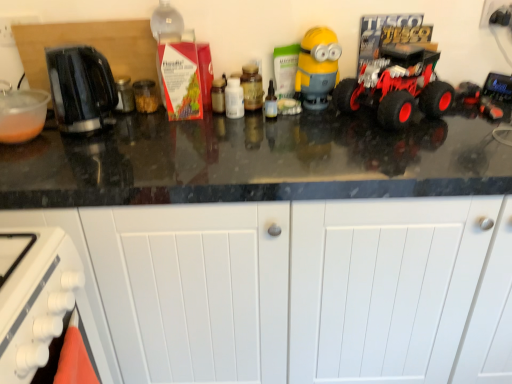
I want to click on transparent glass bottle at center, arranged as the 1th bottle when viewed from the right, so click(270, 103).

In order to face white plastic bottle at center, marked as the 1th bottle in a left-to-right arrangement, should I rotate leftwards or rightwards?

It's best to rotate left around 2.786 degrees.

Measure the distance between point (335, 60) and camera.

A distance of 1.31 meters exists between point (335, 60) and camera.

Where is `rubberized red truck at right`? rubberized red truck at right is located at coordinates (396, 86).

Where is `white matte cabinet at lower center`? This screenshot has height=384, width=512. white matte cabinet at lower center is located at coordinates (296, 285).

From a real-world perspective, between yellow matte minion at center and rubberized red truck at right, who is vertically higher?

In real-world perspective, yellow matte minion at center is above.

Is yellow matte minion at center taller than rubberized red truck at right?

Yes, yellow matte minion at center is taller than rubberized red truck at right.

Looking at this image, is yellow matte minion at center positioned before rubberized red truck at right?

No, it is behind rubberized red truck at right.

Considering the relative positions of yellow matte minion at center and rubberized red truck at right in the image provided, is yellow matte minion at center to the left or to the right of rubberized red truck at right?

Clearly, yellow matte minion at center is on the left of rubberized red truck at right in the image.

From a real-world perspective, relative to yellow matte minion at center, is rubberized red truck at right vertically above or below?

rubberized red truck at right is situated lower than yellow matte minion at center in the real world.

Which of these two, rubberized red truck at right or yellow matte minion at center, is smaller?

yellow matte minion at center is smaller.

Which point is more forward, (x=392, y=51) or (x=302, y=90)?

The point (x=302, y=90) is in front.

Is point (348, 206) positioned before point (62, 127)?

Yes, point (348, 206) is closer to viewer.

At what (x,y) coordinates should I click in order to perform the action: click on cabinetry below the black plastic toaster at left (from the image's perspective). Please return your answer as a coordinate pair (x, y). The height and width of the screenshot is (384, 512). Looking at the image, I should click on (296, 285).

From the image's perspective, between white matte cabinet at lower center and black plastic toaster at left, which one is located above?

black plastic toaster at left is shown above in the image.

From the image's perspective, relative to white matte cabinet at lower center, is transparent glass bottle at center, acting as the 3th bottle starting from the left, above or below?

transparent glass bottle at center, acting as the 3th bottle starting from the left, is situated higher than white matte cabinet at lower center in the image.

Which point is more distant from viewer, (266, 108) or (326, 202)?

The point (266, 108) is farther from the camera.

From a real-world perspective, is transparent glass bottle at center, acting as the 3th bottle starting from the left, positioned above or below white matte cabinet at lower center?

In terms of real-world spatial position, transparent glass bottle at center, acting as the 3th bottle starting from the left, is above white matte cabinet at lower center.

Can you confirm if black plastic toaster at left is wider than matte brown jar at center, placed as the 2th bottle when sorted from left to right?

Indeed, black plastic toaster at left has a greater width compared to matte brown jar at center, placed as the 2th bottle when sorted from left to right.

Is black plastic toaster at left positioned beyond the bounds of matte brown jar at center, placed as the 2th bottle when sorted from left to right?

Yes, black plastic toaster at left is outside of matte brown jar at center, placed as the 2th bottle when sorted from left to right.

Considering their positions, is black plastic toaster at left located in front of or behind matte brown jar at center, which is the second bottle from right to left?

Clearly, black plastic toaster at left is in front of matte brown jar at center, which is the second bottle from right to left.

How many degrees apart are the facing directions of black plastic toaster at left and matte brown jar at center, placed as the 2th bottle when sorted from left to right?

The facing directions of black plastic toaster at left and matte brown jar at center, placed as the 2th bottle when sorted from left to right, are 0.00292 degrees apart.

From a real-world perspective, is rubberized red truck at right physically above white plastic bottle at center, placed as the 3th bottle when sorted from right to left?

Yes, from a real-world perspective, rubberized red truck at right is over white plastic bottle at center, placed as the 3th bottle when sorted from right to left

Is point (392, 118) closer or farther from the camera than point (229, 79)?

Point (392, 118) appears to be closer to the viewer than point (229, 79).

Looking at this image, which is more to the left, rubberized red truck at right or white plastic bottle at center, marked as the 1th bottle in a left-to-right arrangement?

From the viewer's perspective, white plastic bottle at center, marked as the 1th bottle in a left-to-right arrangement, appears more on the left side.

Is white plastic bottle at center, marked as the 1th bottle in a left-to-right arrangement, facing away from yellow matte minion at center?

No, white plastic bottle at center, marked as the 1th bottle in a left-to-right arrangement,'s orientation is not away from yellow matte minion at center.

Does white plastic bottle at center, placed as the 3th bottle when sorted from right to left, lie behind yellow matte minion at center?

Yes, white plastic bottle at center, placed as the 3th bottle when sorted from right to left, is behind yellow matte minion at center.

From the picture: Is white plastic bottle at center, marked as the 1th bottle in a left-to-right arrangement, positioned far away from yellow matte minion at center?

white plastic bottle at center, marked as the 1th bottle in a left-to-right arrangement, is near yellow matte minion at center, not far away.

What's the angular difference between white plastic bottle at center, placed as the 3th bottle when sorted from right to left, and yellow matte minion at center's facing directions?

0.000548 degrees.

In order to click on land vehicle located below the yellow matte minion at center (from the image's perspective) in this screenshot , I will do `click(396, 86)`.

I want to click on land vehicle in front of the yellow matte minion at center, so click(396, 86).

Estimate the real-world distances between objects in this image. Which object is closer to transparent glass bottle at center, arranged as the 1th bottle when viewed from the right, white matte cabinet at lower center or yellow matte minion at center?

yellow matte minion at center is positioned closer to the anchor transparent glass bottle at center, arranged as the 1th bottle when viewed from the right.

Looking at the image, which one is located further to white plastic bottle at center, marked as the 1th bottle in a left-to-right arrangement, yellow matte minion at center or rubberized red truck at right?

The object further to white plastic bottle at center, marked as the 1th bottle in a left-to-right arrangement, is rubberized red truck at right.

When comparing their distances from rubberized red truck at right, does yellow matte minion at center or white plastic bottle at center, marked as the 1th bottle in a left-to-right arrangement, seem closer?

yellow matte minion at center is closer to rubberized red truck at right.

Which object lies further to the anchor point white plastic bottle at center, placed as the 3th bottle when sorted from right to left, transparent glass bottle at center, arranged as the 1th bottle when viewed from the right, or matte brown jar at center, placed as the 2th bottle when sorted from left to right?

transparent glass bottle at center, arranged as the 1th bottle when viewed from the right, is further to white plastic bottle at center, placed as the 3th bottle when sorted from right to left.

Based on their spatial positions, is rubberized red truck at right or matte brown jar at center, placed as the 2th bottle when sorted from left to right, further from white plastic bottle at center, placed as the 3th bottle when sorted from right to left?

rubberized red truck at right lies further to white plastic bottle at center, placed as the 3th bottle when sorted from right to left, than the other object.

When comparing their distances from yellow matte minion at center, does white plastic bottle at center, marked as the 1th bottle in a left-to-right arrangement, or matte brown jar at center, placed as the 2th bottle when sorted from left to right, seem further?

Based on the image, white plastic bottle at center, marked as the 1th bottle in a left-to-right arrangement, appears to be further to yellow matte minion at center.

Considering their positions, is white plastic bottle at center, marked as the 1th bottle in a left-to-right arrangement, positioned closer to rubberized red truck at right than yellow matte minion at center?

yellow matte minion at center lies closer to rubberized red truck at right than the other object.

Considering their positions, is black plastic toaster at left positioned closer to white plastic bottle at center, marked as the 1th bottle in a left-to-right arrangement, than transparent glass bottle at center, arranged as the 1th bottle when viewed from the right?

Based on the image, transparent glass bottle at center, arranged as the 1th bottle when viewed from the right, appears to be nearer to white plastic bottle at center, marked as the 1th bottle in a left-to-right arrangement.

Locate an element on the screen. Image resolution: width=512 pixels, height=384 pixels. toy between black plastic toaster at left and rubberized red truck at right from left to right is located at coordinates (317, 67).

Locate an element on the screen. toy situated between white plastic bottle at center, marked as the 1th bottle in a left-to-right arrangement, and rubberized red truck at right from left to right is located at coordinates (317, 67).

This screenshot has height=384, width=512. Identify the location of toy between transparent glass bottle at center, arranged as the 1th bottle when viewed from the right, and rubberized red truck at right. (317, 67).

In order to click on cabinetry between black plastic toaster at left and yellow matte minion at center from left to right in this screenshot , I will do `click(296, 285)`.